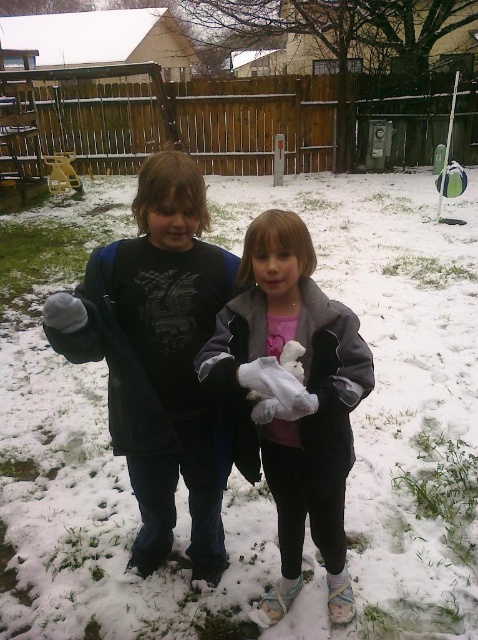
Question: Which point is farther to the camera?

Choices:
 (A) black fleece jacket at center
 (B) metallic yellow slide at left

Answer: (B)

Question: Estimate the real-world distances between objects in this image. Which object is closer to the metallic yellow slide at left?

Choices:
 (A) white fluffy stuffed animal at center
 (B) gray fleece jacket at center
 (C) black fleece jacket at center
 (D) white fluffy snow at center

Answer: (D)

Question: Is black fleece jacket at center behind white fluffy stuffed animal at center?

Choices:
 (A) no
 (B) yes

Answer: (B)

Question: Can you confirm if white fluffy snow at center is bigger than white fluffy stuffed animal at center?

Choices:
 (A) yes
 (B) no

Answer: (A)

Question: Is white fluffy snow at center bigger than metallic yellow slide at left?

Choices:
 (A) yes
 (B) no

Answer: (A)

Question: Considering the real-world distances, which object is farthest from the white fluffy stuffed animal at center?

Choices:
 (A) metallic yellow slide at left
 (B) black fleece jacket at center
 (C) gray fleece jacket at center
 (D) white fluffy snow at center

Answer: (A)